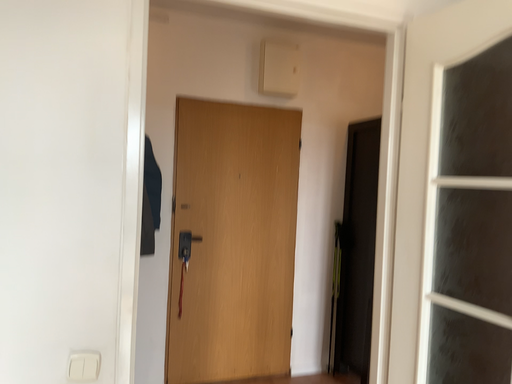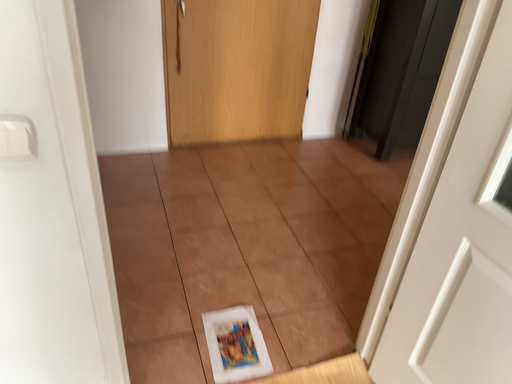
Question: How did the camera likely rotate when shooting the video?

Choices:
 (A) rotated upward
 (B) rotated downward

Answer: (B)